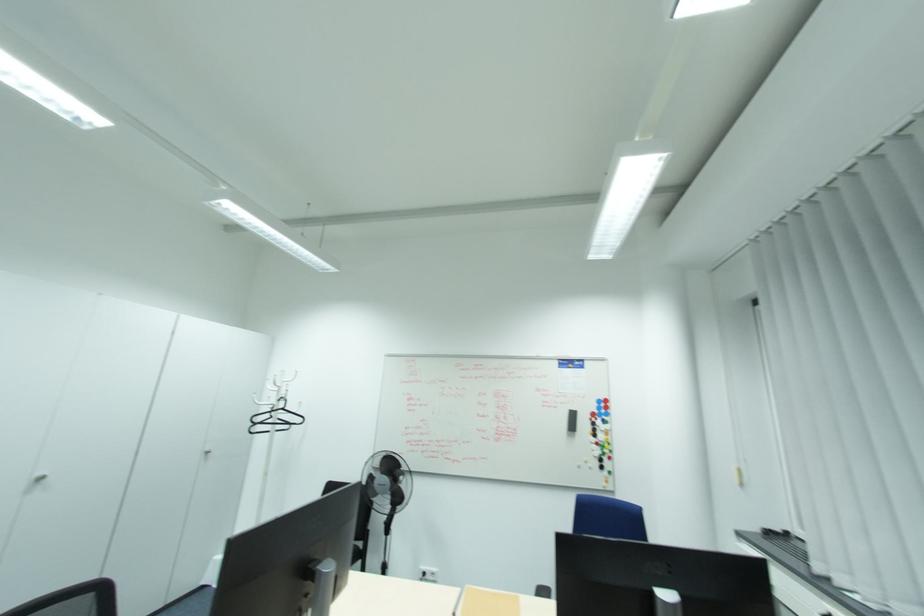
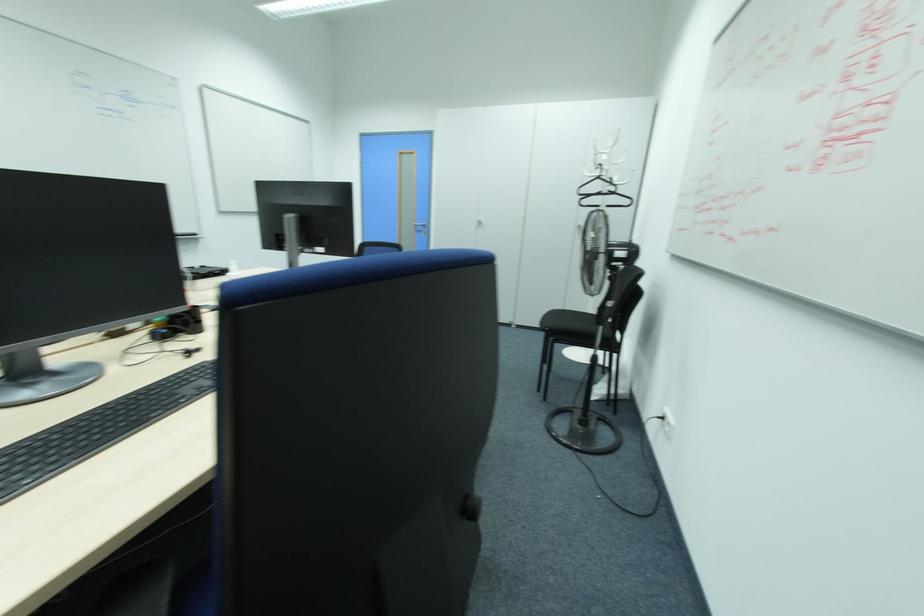
Locate, in the second image, the point that corresponds to the point at 30,492 in the first image.

(479, 227)